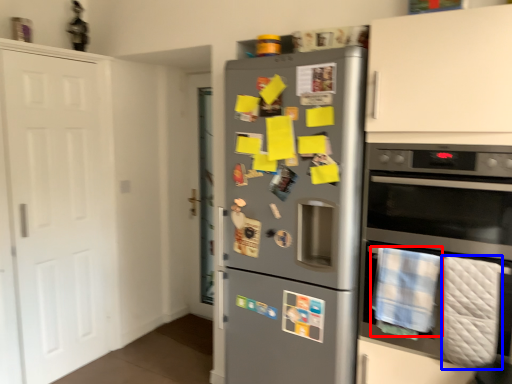
Question: Which of the following is the closest to the observer, blanket (highlighted by a red box) or blanket (highlighted by a blue box)?

Choices:
 (A) blanket
 (B) blanket

Answer: (B)